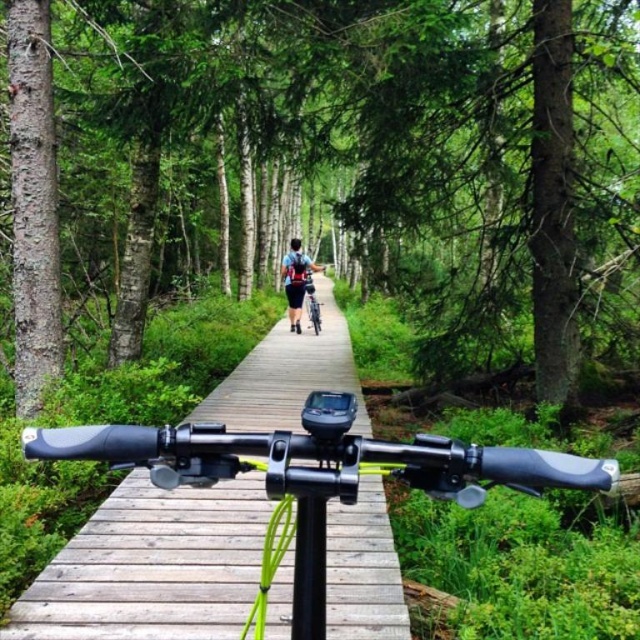
Question: Among these points, which one is farthest from the camera?

Choices:
 (A) (300, 342)
 (B) (308, 275)
 (C) (35, 24)

Answer: (B)

Question: Among these points, which one is farthest from the camera?

Choices:
 (A) (22, 618)
 (B) (294, 252)
 (C) (35, 172)
 (D) (310, 320)

Answer: (D)

Question: From the image, what is the correct spatial relationship of green matte tree at center in relation to silver metallic bicycle at center?

Choices:
 (A) left
 (B) right

Answer: (A)

Question: Which object is positioned farthest from the green matte tree at center?

Choices:
 (A) silver metallic bicycle at center
 (B) dark blue fabric backpack at center

Answer: (A)

Question: Does green matte tree at center appear on the left side of silver metallic bicycle at center?

Choices:
 (A) no
 (B) yes

Answer: (B)

Question: Considering the relative positions of green matte tree at center and wooden boardwalk at center in the image provided, where is green matte tree at center located with respect to wooden boardwalk at center?

Choices:
 (A) above
 (B) below

Answer: (A)